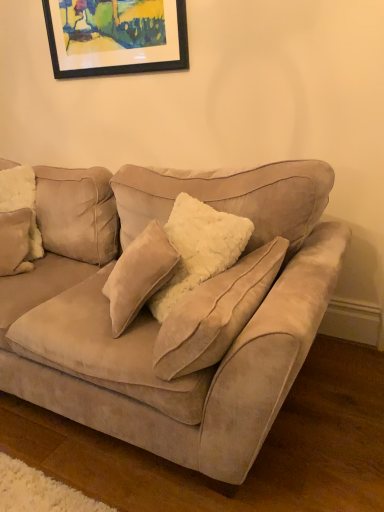
Question: Is fuzzy beige pillow at left in front of or behind black framed picture at upper center in the image?

Choices:
 (A) behind
 (B) front

Answer: (B)

Question: From the image's perspective, is fuzzy beige pillow at left located above or below black framed picture at upper center?

Choices:
 (A) below
 (B) above

Answer: (A)

Question: Which is farther from the black framed picture at upper center?

Choices:
 (A) suede couch at center
 (B) fuzzy beige pillow at left

Answer: (A)

Question: Based on their relative distances, which object is farther from the black framed picture at upper center?

Choices:
 (A) fuzzy beige pillow at left
 (B) suede couch at center

Answer: (B)